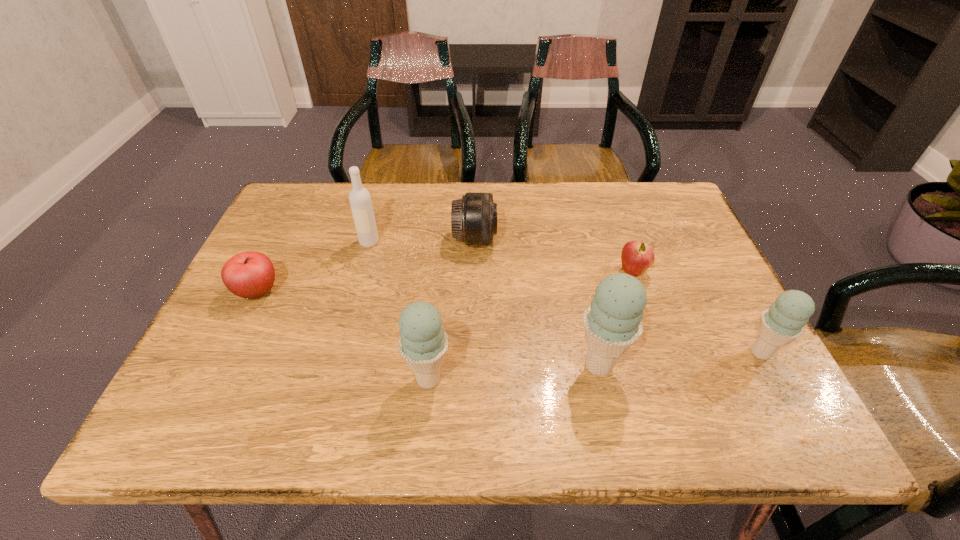
Locate an element on the screen. vacant space that is in between the right apple and the telephoto lens is located at coordinates (554, 255).

The width and height of the screenshot is (960, 540). I want to click on vacant area between the rightmost object and the sixth object from left to right, so click(x=697, y=312).

The image size is (960, 540). What are the coordinates of `vacant space that is in between the telephoto lens and the right apple` in the screenshot? It's located at (554, 255).

Select which object is the third closest to the rightmost ice cream. Please provide its 2D coordinates. Your answer should be formatted as a tuple, i.e. [(x, y)], where the tuple contains the x and y coordinates of a point satisfying the conditions above.

[(474, 217)]

Identify which object is located as the sixth nearest to the second object from left to right. Please provide its 2D coordinates. Your answer should be formatted as a tuple, i.e. [(x, y)], where the tuple contains the x and y coordinates of a point satisfying the conditions above.

[(784, 321)]

Identify which ice cream is the nearest to the fifth tallest object. Please provide its 2D coordinates. Your answer should be formatted as a tuple, i.e. [(x, y)], where the tuple contains the x and y coordinates of a point satisfying the conditions above.

[(612, 323)]

You are a GUI agent. You are given a task and a screenshot of the screen. Output one action in this format:
    pyautogui.click(x=<x>, y=<y>)
    Task: Click on the ice cream that is the second closest to the third shortest object
    
    Given the screenshot: What is the action you would take?
    423,343

This screenshot has height=540, width=960. Identify the location of vacant area that satisfies the following two spatial constraints: 1. on the front side of the fifth object from left to right; 2. on the right side of the left apple. (222, 365).

Where is `free space that satisfies the following two spatial constraints: 1. on the front-facing side of the fifth tallest object; 2. on the back side of the sixth object from left to right`? This screenshot has width=960, height=540. free space that satisfies the following two spatial constraints: 1. on the front-facing side of the fifth tallest object; 2. on the back side of the sixth object from left to right is located at coordinates (474, 271).

Where is `vacant space that satisfies the following two spatial constraints: 1. on the back side of the leftmost object; 2. on the left side of the second object from left to right`? The height and width of the screenshot is (540, 960). vacant space that satisfies the following two spatial constraints: 1. on the back side of the leftmost object; 2. on the left side of the second object from left to right is located at coordinates (281, 242).